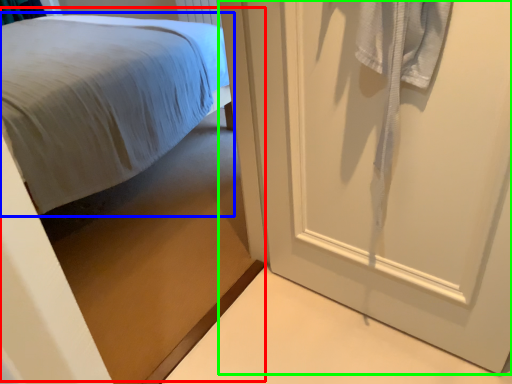
Question: Which object is positioned closest to bed (highlighted by a red box)? Select from bed (highlighted by a blue box) and door (highlighted by a green box).

Choices:
 (A) bed
 (B) door

Answer: (A)